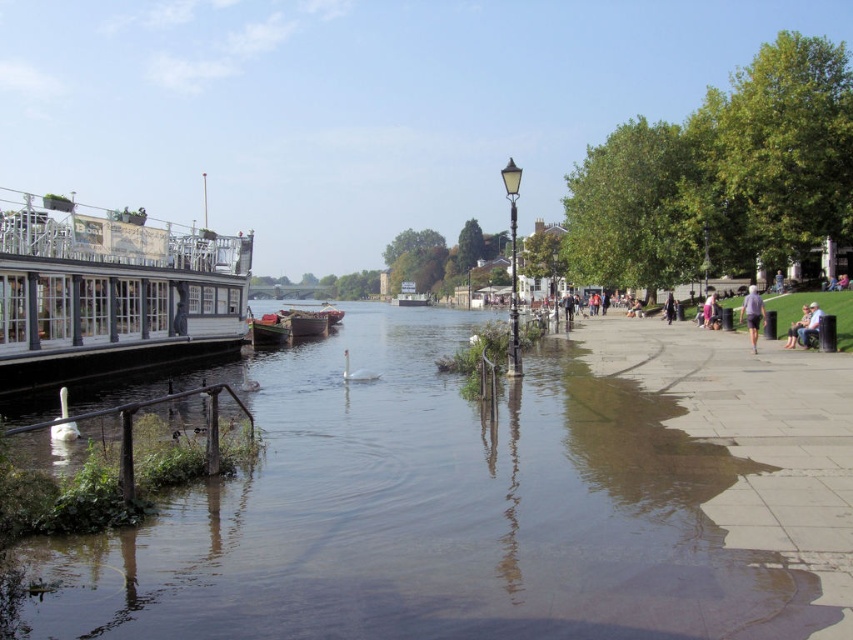
Question: Which point is farther to the camera?

Choices:
 (A) clear water at center
 (B) light brown wooden bench at right
 (C) white wooden boat at left
 (D) dark blue jeans at center

Answer: (D)

Question: Estimate the real-world distances between objects in this image. Which object is closer to the light brown wooden bench at right?

Choices:
 (A) sandy concrete pavement at lower right
 (B) clear water at center
 (C) white wooden boat at left

Answer: (A)

Question: Is sandy concrete pavement at lower right further to the viewer compared to light brown wooden bench at lower right?

Choices:
 (A) no
 (B) yes

Answer: (A)

Question: Which object is farther from the camera taking this photo?

Choices:
 (A) light brown wooden bench at lower right
 (B) gray fabric pants at lower right
 (C) dark blue jeans at center

Answer: (C)

Question: Can you confirm if clear water at center is bigger than gray fabric pants at lower right?

Choices:
 (A) no
 (B) yes

Answer: (A)

Question: Can you confirm if clear water at center is wider than sandy concrete pavement at lower right?

Choices:
 (A) yes
 (B) no

Answer: (A)